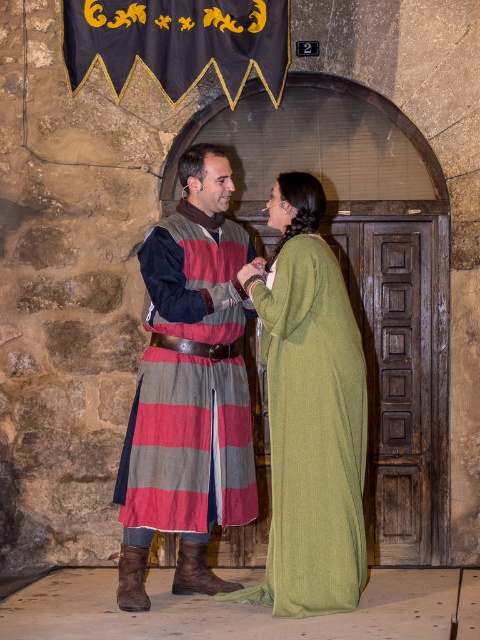
Question: Can you confirm if striped wool tunic at center is thinner than green woolen dress at center?

Choices:
 (A) yes
 (B) no

Answer: (A)

Question: Which object appears closest to the camera in this image?

Choices:
 (A) striped wool tunic at center
 (B) green woolen dress at center

Answer: (B)

Question: Does striped wool tunic at center have a lesser width compared to green woolen dress at center?

Choices:
 (A) yes
 (B) no

Answer: (A)

Question: Which point is closer to the camera taking this photo?

Choices:
 (A) (283, 476)
 (B) (171, 490)

Answer: (A)

Question: Is striped wool tunic at center above green woolen dress at center?

Choices:
 (A) yes
 (B) no

Answer: (A)

Question: Which point is farther from the camera taking this photo?

Choices:
 (A) (285, 269)
 (B) (126, 460)

Answer: (B)